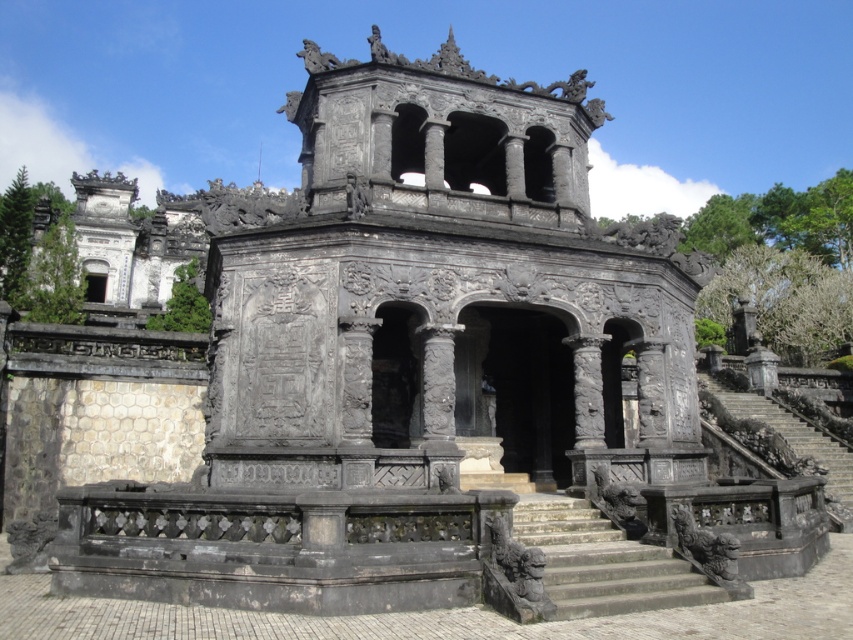
You are an architect examining the stone structure. You need to determine which set of stairs is narrower for a design comparison. Which one is narrower between the stone stairs at center and the dark gray stone stairs at lower right?

The stone stairs at center is thinner than the dark gray stone stairs at lower right, so the stone stairs at center is narrower.

You are an architect examining the stone structure. You notice two sets of stairs leading to different parts of the building. The stone stairs at center and the dark gray stone stairs at lower right. Which set of stairs is smaller in size?

The stone stairs at center is smaller in size compared to the dark gray stone stairs at lower right according to the description.

You are standing at a distance of 30 meters away from the grand stone structure. You want to reach the point marked as point (550,570) on the structure. Is the point within your current reach without moving closer?

The distance of point (550,570) from viewer is 26.86 meters, so yes, the point is within reach since it is closer than your current position at 30 meters.